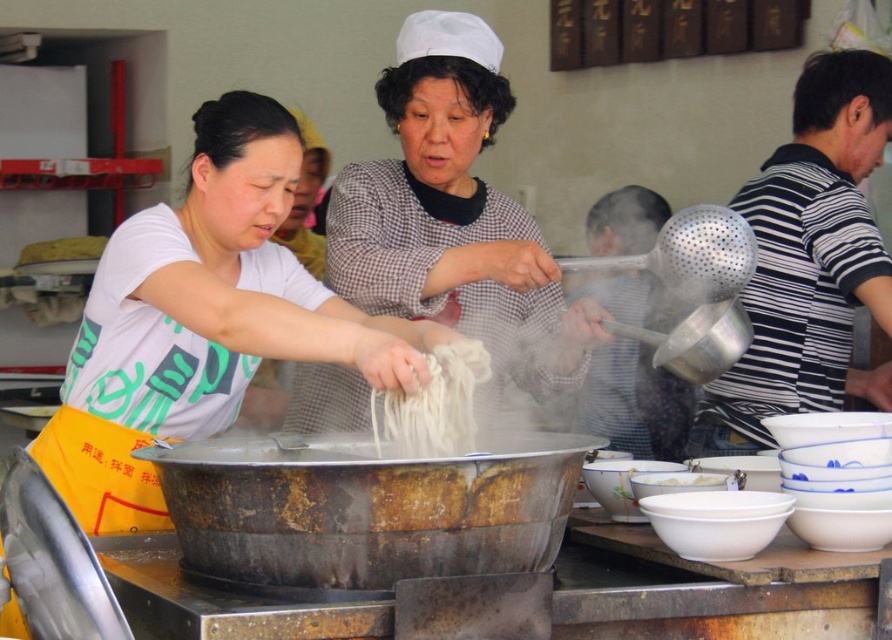
You are standing in front of the street food stall and need to locate the matte white shirt at center. According to the coordinates provided, where exactly would you find it?

The matte white shirt at center is located at point coordinates of 0.498 on the x axis and 0.230 on the y axis.

You are a food stall worker who needs to serve a customer. You have a rusty metal wok at center and white matte noodles at center. Which object can you use to serve the noodles directly to the customer?

The rusty metal wok at center can be used to serve the noodles directly to the customer since it is larger than the white matte noodles at center and likely holds them.

You are a customer observing the two staff members at the food stall. The staff members are wearing a matte white shirt at center and a checkered fabric shirt at center. Which staff member is shorter?

The matte white shirt at center is not as tall as checkered fabric shirt at center, so the staff member wearing the matte white shirt at center is shorter.